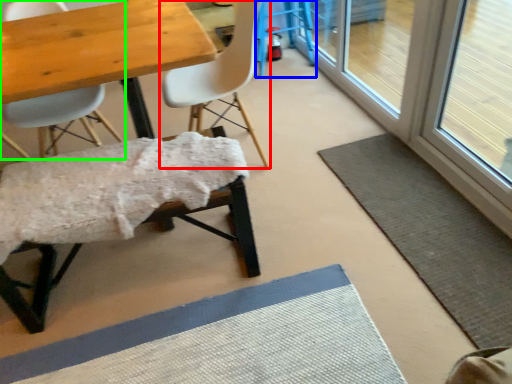
Question: Which is farther away from chair (highlighted by a red box)? bar stool (highlighted by a blue box) or chair (highlighted by a green box)?

Choices:
 (A) bar stool
 (B) chair

Answer: (A)